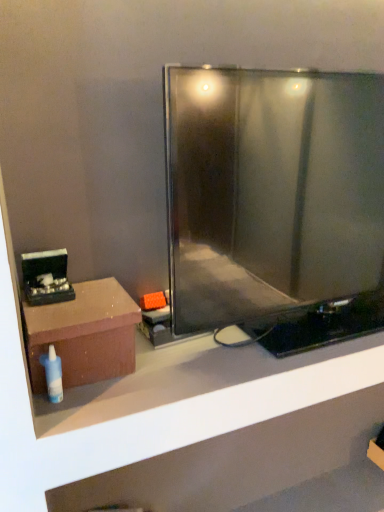
Question: Is matte brown box at left at the left side of brown matte shelf at lower left?

Choices:
 (A) no
 (B) yes

Answer: (B)

Question: From the image's perspective, would you say matte brown box at left is shown under brown matte shelf at lower left?

Choices:
 (A) yes
 (B) no

Answer: (B)

Question: Is matte brown box at left further to camera compared to brown matte shelf at lower left?

Choices:
 (A) yes
 (B) no

Answer: (A)

Question: Is matte brown box at left not within brown matte shelf at lower left?

Choices:
 (A) no
 (B) yes

Answer: (B)

Question: From a real-world perspective, is matte brown box at left located beneath brown matte shelf at lower left?

Choices:
 (A) yes
 (B) no

Answer: (B)

Question: Visually, is brown matte shelf at lower left positioned to the left or to the right of white plastic bottle at lower left?

Choices:
 (A) left
 (B) right

Answer: (B)

Question: Is point (369, 417) closer or farther from the camera than point (51, 347)?

Choices:
 (A) closer
 (B) farther

Answer: (B)

Question: From their relative heights in the image, would you say brown matte shelf at lower left is taller or shorter than white plastic bottle at lower left?

Choices:
 (A) tall
 (B) short

Answer: (A)

Question: Is brown matte shelf at lower left in front of or behind white plastic bottle at lower left in the image?

Choices:
 (A) behind
 (B) front

Answer: (B)

Question: Is point (248, 310) positioned closer to the camera than point (41, 442)?

Choices:
 (A) farther
 (B) closer

Answer: (A)

Question: In the image, is metallic flat-screen tv at center positioned in front of or behind brown matte shelf at lower left?

Choices:
 (A) front
 (B) behind

Answer: (A)

Question: From a real-world perspective, is metallic flat-screen tv at center positioned above or below brown matte shelf at lower left?

Choices:
 (A) above
 (B) below

Answer: (A)

Question: Considering the relative positions of metallic flat-screen tv at center and brown matte shelf at lower left in the image provided, is metallic flat-screen tv at center to the left or to the right of brown matte shelf at lower left?

Choices:
 (A) right
 (B) left

Answer: (A)

Question: In terms of height, does matte brown box at left look taller or shorter compared to white plastic bottle at lower left?

Choices:
 (A) tall
 (B) short

Answer: (A)

Question: From a real-world perspective, is matte brown box at left positioned above or below white plastic bottle at lower left?

Choices:
 (A) below
 (B) above

Answer: (B)